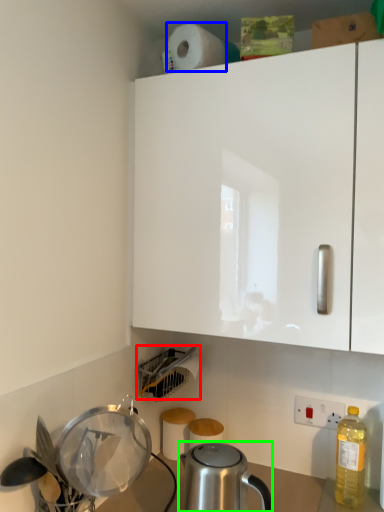
Question: Based on their relative distances, which object is nearer to appliance (highlighted by a red box)? Choose from paper towel (highlighted by a blue box) and kettle (highlighted by a green box).

Choices:
 (A) paper towel
 (B) kettle

Answer: (B)